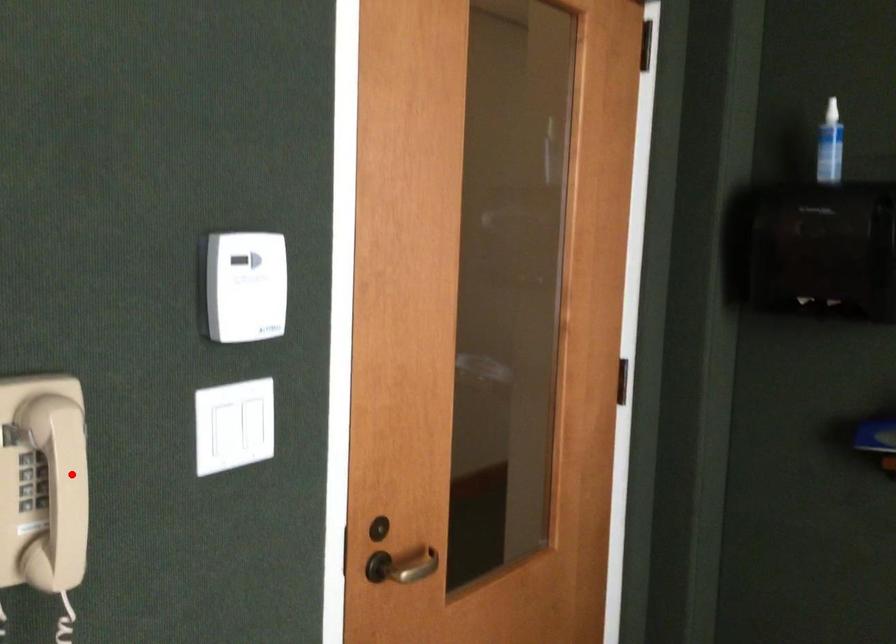
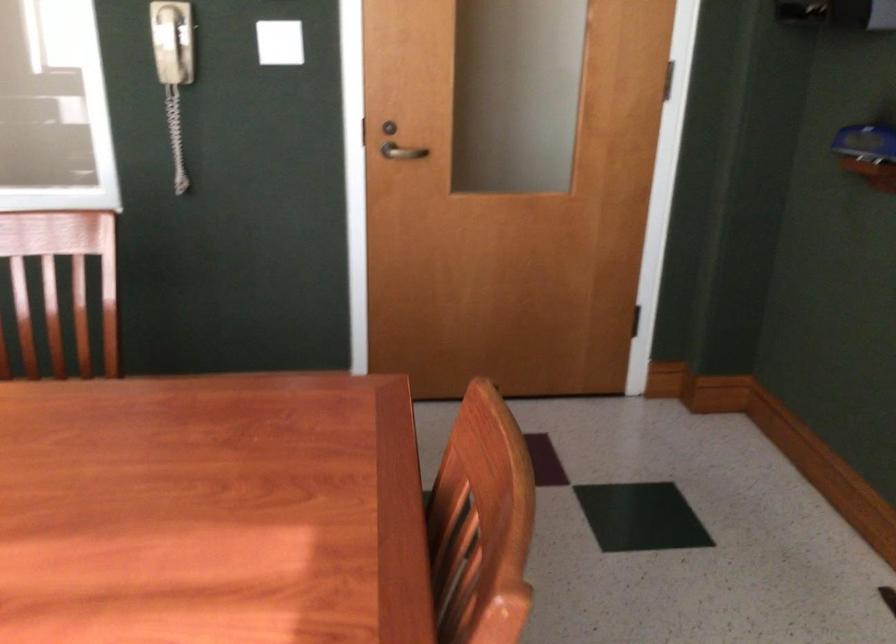
Question: I am providing you with two images of the same scene from different viewpoints. A red point is shown in image1. For the corresponding object point in image2, is it positioned nearer or farther from the camera?

Choices:
 (A) Nearer
 (B) Farther

Answer: (B)